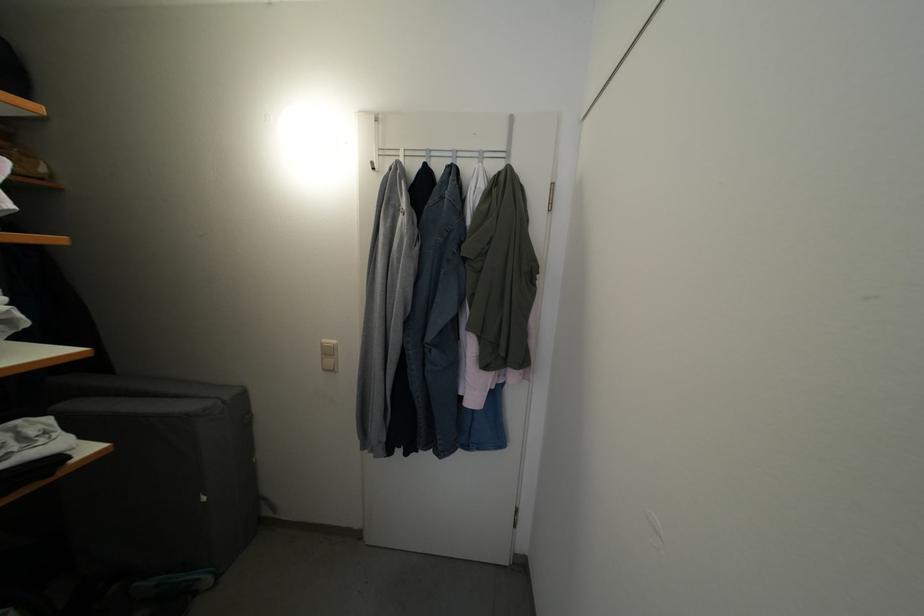
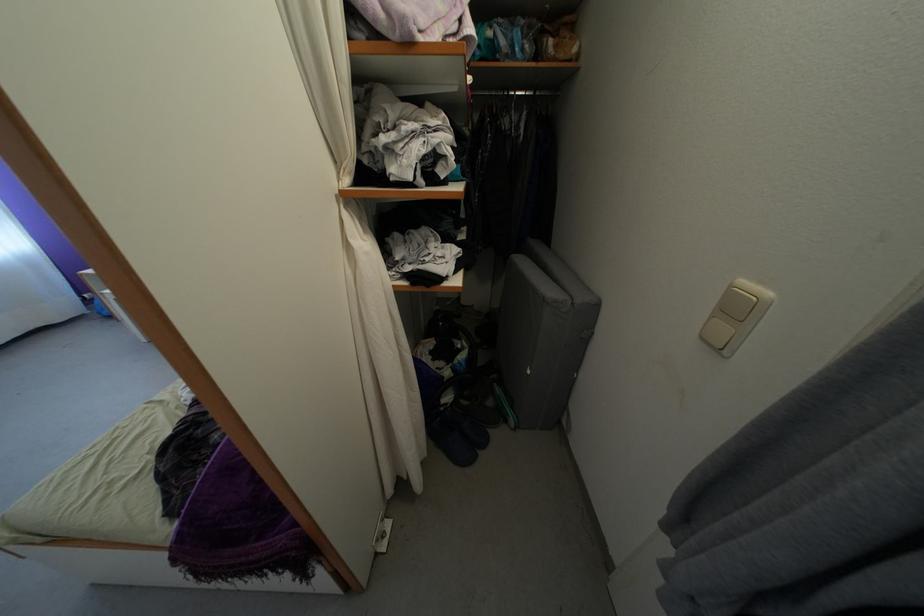
Locate, in the second image, the point that corresponds to [334,358] in the first image.

(743, 315)